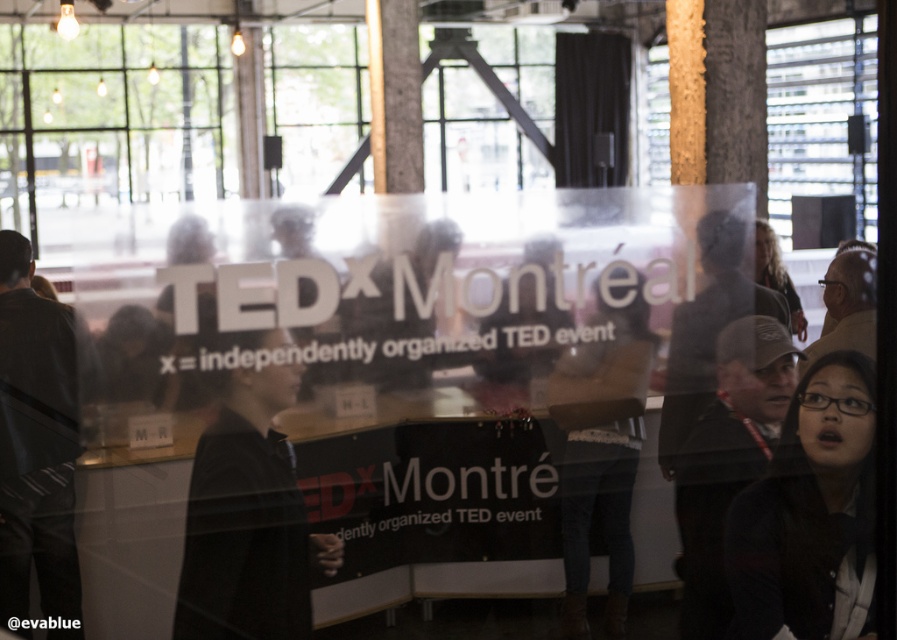
You are organizing a photo shoot in this space and need to position two props. The denim pants at center and the wooden at upper right. Which prop takes up more physical space in the scene?

The wooden at upper right takes up more physical space in the scene than the denim pants at center.